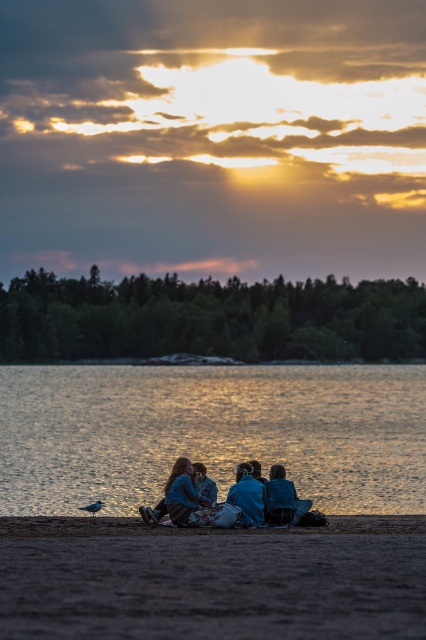
Question: Can you confirm if glistening water at lower center is positioned below blue fabric people at center?

Choices:
 (A) yes
 (B) no

Answer: (B)

Question: Which of the following is the farthest from the observer?

Choices:
 (A) (238, 468)
 (B) (175, 385)

Answer: (B)

Question: Which object appears farthest from the camera in this image?

Choices:
 (A) glistening water at lower center
 (B) brown sandy beach at lower center

Answer: (A)

Question: Does glistening water at lower center have a lesser width compared to brown sandy beach at lower center?

Choices:
 (A) no
 (B) yes

Answer: (A)

Question: Does glistening water at lower center appear on the left side of brown sandy beach at lower center?

Choices:
 (A) yes
 (B) no

Answer: (A)

Question: Which point appears closest to the camera in this image?

Choices:
 (A) (183, 502)
 (B) (46, 477)

Answer: (A)